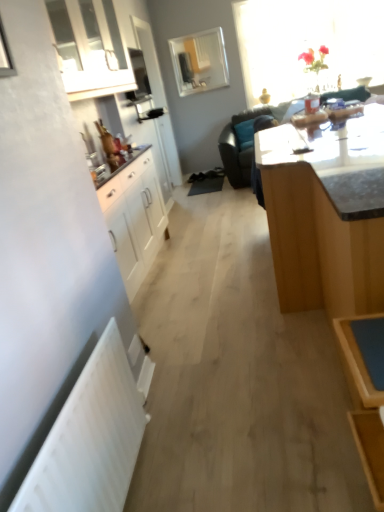
Identify the location of white glossy cabinet at upper left. The image size is (384, 512). (90, 48).

You are a GUI agent. You are given a task and a screenshot of the screen. Output one action in this format:
    pyautogui.click(x=<x>, y=<y>)
    Task: Click on the clear glass mirror at upper center, the first window positioned from the left
    This screenshot has width=384, height=512.
    Given the screenshot: What is the action you would take?
    pyautogui.click(x=199, y=61)

The image size is (384, 512). What do you see at coordinates (327, 214) in the screenshot?
I see `light brown wooden table at center` at bounding box center [327, 214].

Describe the element at coordinates (90, 438) in the screenshot. I see `white matte radiator at lower left` at that location.

Where is `white glossy cabinet at upper left`? The height and width of the screenshot is (512, 384). white glossy cabinet at upper left is located at coordinates (90, 48).

Based on the photo, does light brown wooden table at center appear on the left side of white glossy cabinet at upper left?

Incorrect, light brown wooden table at center is not on the left side of white glossy cabinet at upper left.

Locate an element on the screen. The height and width of the screenshot is (512, 384). cabinetry above the light brown wooden table at center (from a real-world perspective) is located at coordinates (90, 48).

Which point is more distant from viewer, (x=290, y=280) or (x=91, y=20)?

The point (x=91, y=20) is behind.

From a real-world perspective, is light brown wooden table at center positioned over white glossy cabinet at upper left based on gravity?

No, from a real-world perspective, light brown wooden table at center is not above white glossy cabinet at upper left.

From a real-world perspective, who is located lower, black leather couch at upper center or light brown wooden table at center?

From a 3D spatial view, black leather couch at upper center is below.

The width and height of the screenshot is (384, 512). Find the location of `table to the left of black leather couch at upper center`. table to the left of black leather couch at upper center is located at coordinates (327, 214).

Which is in front, point (227, 173) or point (283, 228)?

The point (283, 228) is closer to the camera.

Considering the sizes of objects black leather couch at upper center and light brown wooden table at center in the image provided, who is bigger, black leather couch at upper center or light brown wooden table at center?

Bigger between the two is black leather couch at upper center.

Does translucent glass vase at upper right, positioned as the 2th window in left-to-right order, appear on the left side of clear glass mirror at upper center, which ranks as the 2th window in right-to-left order?

No.

Considering the sizes of objects translucent glass vase at upper right, positioned as the 2th window in left-to-right order, and clear glass mirror at upper center, which ranks as the 2th window in right-to-left order, in the image provided, who is taller, translucent glass vase at upper right, positioned as the 2th window in left-to-right order, or clear glass mirror at upper center, which ranks as the 2th window in right-to-left order,?

With more height is translucent glass vase at upper right, positioned as the 2th window in left-to-right order.

Considering the sizes of translucent glass vase at upper right, marked as the first window in a right-to-left arrangement, and clear glass mirror at upper center, the first window positioned from the left, in the image, is translucent glass vase at upper right, marked as the first window in a right-to-left arrangement, wider or thinner than clear glass mirror at upper center, the first window positioned from the left,?

Clearly, translucent glass vase at upper right, marked as the first window in a right-to-left arrangement, has more width compared to clear glass mirror at upper center, the first window positioned from the left.

From a real-world perspective, which object rests below the other?

translucent glass vase at upper right, positioned as the 2th window in left-to-right order.

Are white glossy cabinet at upper left and black leather couch at upper center beside each other?

No, white glossy cabinet at upper left is not beside black leather couch at upper center.

Which object is closer to the camera, white glossy cabinet at upper left or black leather couch at upper center?

Positioned in front is white glossy cabinet at upper left.

What's the angular difference between white glossy cabinet at upper left and black leather couch at upper center's facing directions?

white glossy cabinet at upper left and black leather couch at upper center are facing 91.1 degrees away from each other.

Considering the sizes of white glossy cabinet at upper left and black leather couch at upper center in the image, is white glossy cabinet at upper left taller or shorter than black leather couch at upper center?

In the image, white glossy cabinet at upper left appears to be shorter than black leather couch at upper center.

Based on the photo, in terms of height, does white matte radiator at lower left look taller or shorter compared to black leather couch at upper center?

Clearly, white matte radiator at lower left is shorter compared to black leather couch at upper center.

Looking at this image, in the image, is white matte radiator at lower left positioned in front of or behind black leather couch at upper center?

In the image, white matte radiator at lower left appears in front of black leather couch at upper center.

Does white matte radiator at lower left turn towards black leather couch at upper center?

No, white matte radiator at lower left is not turned towards black leather couch at upper center.

From the image's perspective, does white matte radiator at lower left appear higher than black leather couch at upper center?

No, from the image's perspective, white matte radiator at lower left is not above black leather couch at upper center.

Is black leather couch at upper center with white matte radiator at lower left?

No, black leather couch at upper center is not with white matte radiator at lower left.

Is black leather couch at upper center positioned with its back to white matte radiator at lower left?

No.

Is the depth of black leather couch at upper center less than that of white matte radiator at lower left?

No, it is not.

At what (x,y) coordinates should I click in order to perform the action: click on studio couch behind the white matte radiator at lower left. Please return your answer as a coordinate pair (x, y). The width and height of the screenshot is (384, 512). Looking at the image, I should click on (240, 146).

In terms of width, does light brown wooden table at center look wider or thinner when compared to black leather couch at upper center?

light brown wooden table at center is thinner than black leather couch at upper center.

From a real-world perspective, does light brown wooden table at center sit lower than black leather couch at upper center?

No.

Is light brown wooden table at center far away from black leather couch at upper center?

That's right, there is a large distance between light brown wooden table at center and black leather couch at upper center.

The width and height of the screenshot is (384, 512). I want to click on table below the white glossy cabinet at upper left (from the image's perspective), so click(327, 214).

In order to click on table on the left side of black leather couch at upper center in this screenshot , I will do `click(327, 214)`.

From the image, which object appears to be nearer to clear glass mirror at upper center, which ranks as the 2th window in right-to-left order, black leather couch at upper center or white glossy cabinet at upper left?

black leather couch at upper center is closer to clear glass mirror at upper center, which ranks as the 2th window in right-to-left order.

Estimate the real-world distances between objects in this image. Which object is closer to translucent glass vase at upper right, positioned as the 2th window in left-to-right order, clear glass mirror at upper center, which ranks as the 2th window in right-to-left order, or light brown wooden table at center?

clear glass mirror at upper center, which ranks as the 2th window in right-to-left order, is closer to translucent glass vase at upper right, positioned as the 2th window in left-to-right order.

Considering their positions, is white matte radiator at lower left positioned further to clear glass mirror at upper center, the first window positioned from the left, than white glossy cabinet at upper left?

Based on the image, white matte radiator at lower left appears to be further to clear glass mirror at upper center, the first window positioned from the left.

From the image, which object appears to be farther from clear glass mirror at upper center, the first window positioned from the left, light brown wooden table at center or black leather couch at upper center?

light brown wooden table at center lies further to clear glass mirror at upper center, the first window positioned from the left, than the other object.

Estimate the real-world distances between objects in this image. Which object is further from clear glass mirror at upper center, which ranks as the 2th window in right-to-left order, black leather couch at upper center or white matte radiator at lower left?

white matte radiator at lower left.

Considering their positions, is white matte radiator at lower left positioned further to translucent glass vase at upper right, positioned as the 2th window in left-to-right order, than black leather couch at upper center?

white matte radiator at lower left.

Considering their positions, is translucent glass vase at upper right, marked as the first window in a right-to-left arrangement, positioned further to white matte radiator at lower left than light brown wooden table at center?

Based on the image, translucent glass vase at upper right, marked as the first window in a right-to-left arrangement, appears to be further to white matte radiator at lower left.

Which object lies further to the anchor point white matte radiator at lower left, clear glass mirror at upper center, which ranks as the 2th window in right-to-left order, or light brown wooden table at center?

Among the two, clear glass mirror at upper center, which ranks as the 2th window in right-to-left order, is located further to white matte radiator at lower left.

Locate an element on the screen. The width and height of the screenshot is (384, 512). cabinetry between light brown wooden table at center and translucent glass vase at upper right, marked as the first window in a right-to-left arrangement, from front to back is located at coordinates (90, 48).

Locate an element on the screen. This screenshot has width=384, height=512. cabinetry between light brown wooden table at center and clear glass mirror at upper center, which ranks as the 2th window in right-to-left order, from front to back is located at coordinates (90, 48).

Locate an element on the screen. The image size is (384, 512). window located between white matte radiator at lower left and clear glass mirror at upper center, the first window positioned from the left, in the depth direction is located at coordinates (307, 44).

Locate an element on the screen. The height and width of the screenshot is (512, 384). cabinetry positioned between light brown wooden table at center and black leather couch at upper center from near to far is located at coordinates (90, 48).